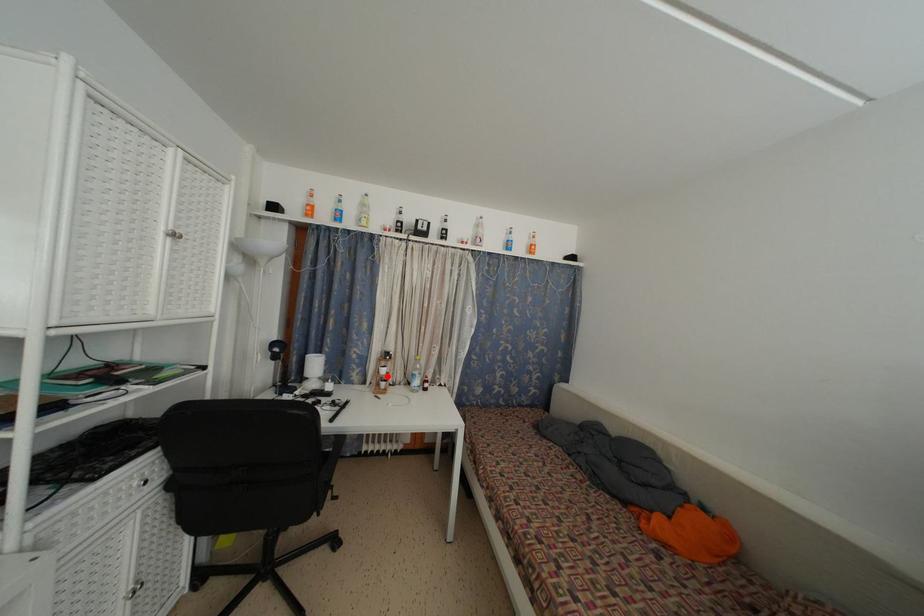
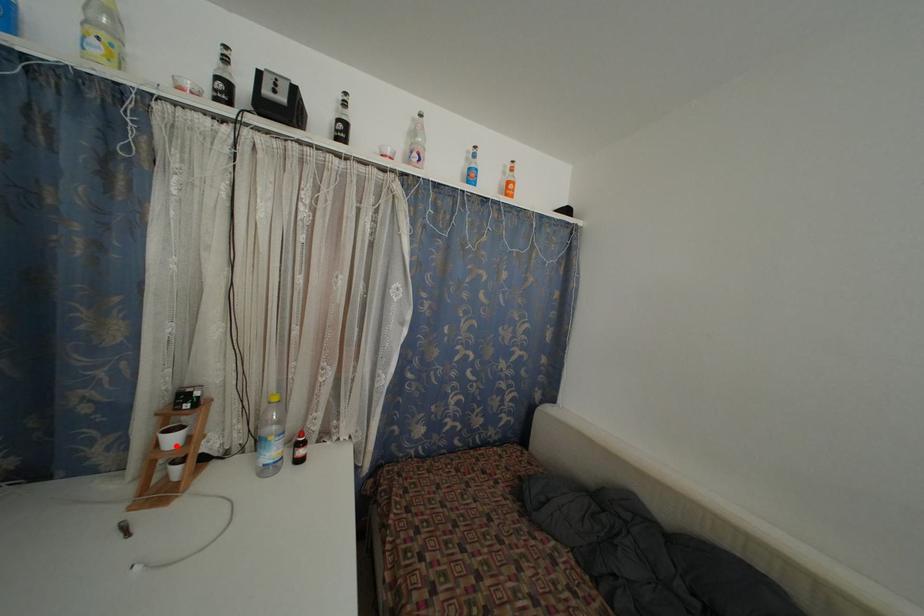
I am providing you with two images of the same scene from different viewpoints. A red point is marked on the first image and another point is marked on the second image. Do the highlighted points in image1 and image2 indicate the same real-world spot?

Yes